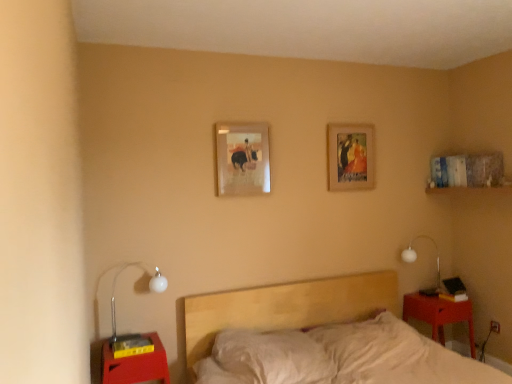
Question: Is light wood bed at center positioned with its back to wooden picture frame at upper center, arranged as the 2th picture frame when viewed from the left?

Choices:
 (A) yes
 (B) no

Answer: (B)

Question: Does light wood bed at center have a lesser height compared to wooden picture frame at upper center, arranged as the 2th picture frame when viewed from the left?

Choices:
 (A) yes
 (B) no

Answer: (B)

Question: Is wooden picture frame at upper center, the 2th picture frame from the front, completely or partially inside light wood bed at center?

Choices:
 (A) no
 (B) yes

Answer: (A)

Question: Is light wood bed at center bigger than wooden picture frame at upper center, arranged as the 1th picture frame when viewed from the right?

Choices:
 (A) yes
 (B) no

Answer: (A)

Question: Is the position of light wood bed at center more distant than that of wooden picture frame at upper center, the first picture frame viewed from the back?

Choices:
 (A) yes
 (B) no

Answer: (B)

Question: Can you confirm if light wood bed at center is positioned to the left of wooden picture frame at upper center, the 2th picture frame from the front?

Choices:
 (A) no
 (B) yes

Answer: (B)

Question: Does matte red nightstand at lower left, acting as the 2th nightstand starting from the back, contain white glass lamp at left, which is the first lamp from left to right?

Choices:
 (A) yes
 (B) no

Answer: (B)

Question: Is there a large distance between matte red nightstand at lower left, acting as the 2th nightstand starting from the back, and white glass lamp at left, which is the first lamp from left to right?

Choices:
 (A) yes
 (B) no

Answer: (B)

Question: Is matte red nightstand at lower left, the 2th nightstand in the right-to-left sequence, positioned in front of white glass lamp at left, which is counted as the 2th lamp, starting from the right?

Choices:
 (A) yes
 (B) no

Answer: (A)

Question: From the image's perspective, is matte red nightstand at lower left, which is the first nightstand in front-to-back order, located above white glass lamp at left, arranged as the 1th lamp when viewed from the front?

Choices:
 (A) no
 (B) yes

Answer: (A)

Question: Considering the relative positions of matte red nightstand at lower left, acting as the 2th nightstand starting from the back, and white glass lamp at left, arranged as the 1th lamp when viewed from the front, in the image provided, is matte red nightstand at lower left, acting as the 2th nightstand starting from the back, to the right of white glass lamp at left, arranged as the 1th lamp when viewed from the front, from the viewer's perspective?

Choices:
 (A) yes
 (B) no

Answer: (A)

Question: Can you confirm if matte red nightstand at lower left, the first nightstand when ordered from left to right, is wider than white glass lamp at left, which is counted as the 2th lamp, starting from the right?

Choices:
 (A) no
 (B) yes

Answer: (B)

Question: Is light wood bed at center positioned far away from matte red wood nightstand at lower right, marked as the first nightstand in a right-to-left arrangement?

Choices:
 (A) no
 (B) yes

Answer: (A)